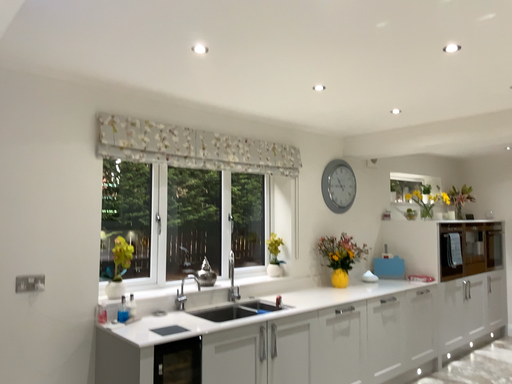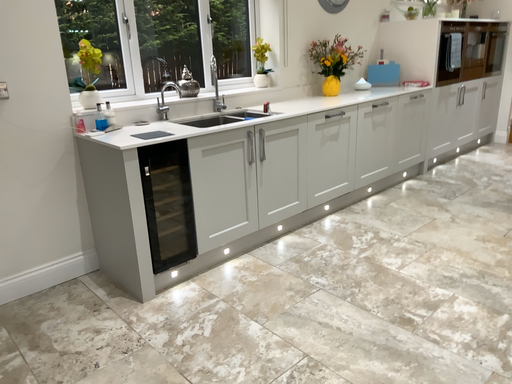
Question: How did the camera likely rotate when shooting the video?

Choices:
 (A) rotated upward
 (B) rotated downward

Answer: (B)